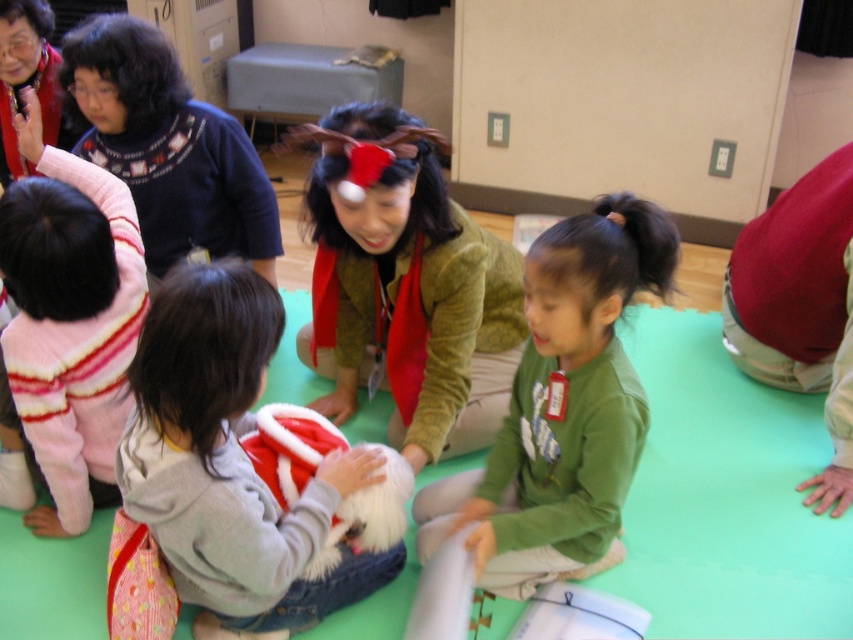
Question: Which point is farther to the camera?

Choices:
 (A) green matte shirt at center
 (B) striped fleece sweater at upper left

Answer: (B)

Question: Considering the real-world distances, which object is closest to the gray fleece hoodie at center?

Choices:
 (A) striped fleece sweater at upper left
 (B) blue sweater at upper left

Answer: (A)

Question: Is gray fleece hoodie at center below striped fleece sweater at upper left?

Choices:
 (A) no
 (B) yes

Answer: (B)

Question: Estimate the real-world distances between objects in this image. Which object is farther from the striped fleece sweater at upper left?

Choices:
 (A) gray fleece hoodie at center
 (B) blue sweater at upper left
 (C) green matte shirt at center

Answer: (C)

Question: Does gray fleece hoodie at center have a greater width compared to blue sweater at upper left?

Choices:
 (A) yes
 (B) no

Answer: (A)

Question: Does gray fleece hoodie at center have a larger size compared to striped fleece sweater at upper left?

Choices:
 (A) no
 (B) yes

Answer: (B)